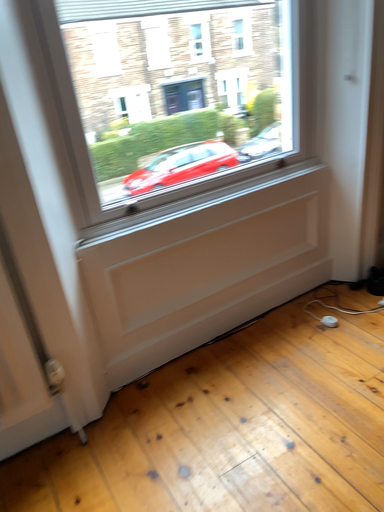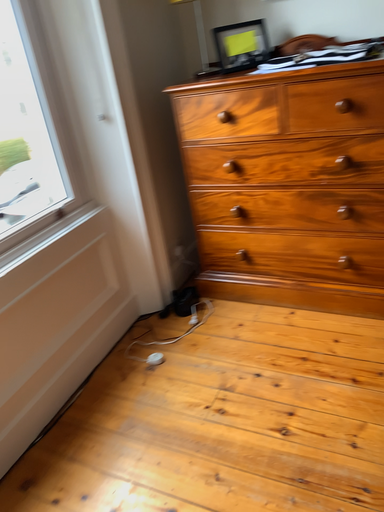
Question: How did the camera likely rotate when shooting the video?

Choices:
 (A) rotated downward
 (B) rotated upward

Answer: (B)